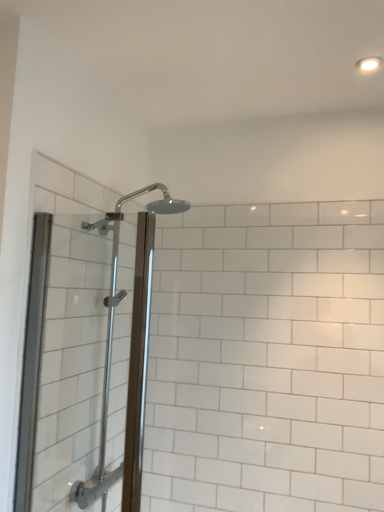
Measure the distance between point (375,57) and camera.

A distance of 1.39 meters exists between point (375,57) and camera.

Locate an element on the screen. This screenshot has height=512, width=384. polished chrome shower head at upper center is located at coordinates (130, 352).

From the image's perspective, is clear glass shower door at left located above polished chrome shower head at upper center?

Yes, from the image's perspective, clear glass shower door at left is over polished chrome shower head at upper center.

Which is farther from the camera, (123, 257) or (109, 477)?

Positioned behind is point (123, 257).

Between clear glass shower door at left and polished chrome shower head at upper center, which one has larger size?

polished chrome shower head at upper center is bigger.

Considering the sizes of clear glass shower door at left and polished chrome shower head at upper center in the image, is clear glass shower door at left wider or thinner than polished chrome shower head at upper center?

In the image, clear glass shower door at left appears to be more narrow than polished chrome shower head at upper center.

Based on the photo, how many degrees apart are the facing directions of polished chrome shower head at upper center and clear glass shower door at left?

90 degrees separate the facing orientations of polished chrome shower head at upper center and clear glass shower door at left.

Based on the photo, from the image's perspective, relative to clear glass shower door at left, is polished chrome shower head at upper center above or below?

polished chrome shower head at upper center is situated lower than clear glass shower door at left in the image.

Considering the sizes of objects polished chrome shower head at upper center and clear glass shower door at left in the image provided, who is bigger, polished chrome shower head at upper center or clear glass shower door at left?

polished chrome shower head at upper center.

Which object is positioned more to the right, polished chrome shower head at upper center or clear glass shower door at left?

From the viewer's perspective, polished chrome shower head at upper center appears more on the right side.

Is point (364, 68) positioned behind point (136, 325)?

Yes, point (364, 68) is farther from viewer.

Could you tell me if white glossy light fixture at upper right is facing polished chrome shower head at upper center?

No, white glossy light fixture at upper right is not facing towards polished chrome shower head at upper center.

Can you see white glossy light fixture at upper right touching polished chrome shower head at upper center?

No, white glossy light fixture at upper right is not touching polished chrome shower head at upper center.

Is white glossy light fixture at upper right taller than polished chrome shower head at upper center?

In fact, white glossy light fixture at upper right may be shorter than polished chrome shower head at upper center.

In the scene shown: From a real-world perspective, which object rests below the other?

clear glass shower door at left, from a real-world perspective.

Is clear glass shower door at left inside white glossy light fixture at upper right?

No, clear glass shower door at left is not surrounded by white glossy light fixture at upper right.

From the image's perspective, is white glossy light fixture at upper right below clear glass shower door at left?

Actually, white glossy light fixture at upper right appears above clear glass shower door at left in the image.

In the scene shown: Considering the positions of objects clear glass shower door at left and white glossy light fixture at upper right in the image provided, who is more to the left, clear glass shower door at left or white glossy light fixture at upper right?

From the viewer's perspective, clear glass shower door at left appears more on the left side.

Between clear glass shower door at left and white glossy light fixture at upper right, which one has larger size?

clear glass shower door at left is bigger.

How distant is clear glass shower door at left from white glossy light fixture at upper right?

A: 1.38 meters.

From a real-world perspective, which object stands above the other?

white glossy light fixture at upper right.

Is white glossy light fixture at upper right at the back of polished chrome shower head at upper center?

No.

Considering the sizes of polished chrome shower head at upper center and white glossy light fixture at upper right in the image, is polished chrome shower head at upper center wider or thinner than white glossy light fixture at upper right?

polished chrome shower head at upper center is wider than white glossy light fixture at upper right.

How different are the orientations of polished chrome shower head at upper center and white glossy light fixture at upper right in degrees?

polished chrome shower head at upper center and white glossy light fixture at upper right are facing 96 degrees away from each other.

From the image's perspective, which is above, polished chrome shower head at upper center or white glossy light fixture at upper right?

white glossy light fixture at upper right is shown above in the image.

In the image, there is a clear glass shower door at left. Where is `shower below it (from a real-world perspective)`? Image resolution: width=384 pixels, height=512 pixels. shower below it (from a real-world perspective) is located at coordinates (130, 352).

Where is `screen door above the polished chrome shower head at upper center (from a real-world perspective)`? Image resolution: width=384 pixels, height=512 pixels. screen door above the polished chrome shower head at upper center (from a real-world perspective) is located at coordinates (62, 364).

Considering their positions, is polished chrome shower head at upper center positioned closer to white glossy light fixture at upper right than clear glass shower door at left?

polished chrome shower head at upper center is positioned closer to the anchor white glossy light fixture at upper right.

From the image, which object appears to be farther from clear glass shower door at left, white glossy light fixture at upper right or polished chrome shower head at upper center?

Among the two, white glossy light fixture at upper right is located further to clear glass shower door at left.

Estimate the real-world distances between objects in this image. Which object is closer to polished chrome shower head at upper center, clear glass shower door at left or white glossy light fixture at upper right?

The object closer to polished chrome shower head at upper center is clear glass shower door at left.

Looking at the image, which one is located further to polished chrome shower head at upper center, white glossy light fixture at upper right or clear glass shower door at left?

The object further to polished chrome shower head at upper center is white glossy light fixture at upper right.

Which object lies further to the anchor point white glossy light fixture at upper right, clear glass shower door at left or polished chrome shower head at upper center?

clear glass shower door at left is positioned further to the anchor white glossy light fixture at upper right.

When comparing their distances from clear glass shower door at left, does polished chrome shower head at upper center or white glossy light fixture at upper right seem closer?

polished chrome shower head at upper center.

In order to click on screen door between white glossy light fixture at upper right and polished chrome shower head at upper center vertically in this screenshot , I will do click(62, 364).